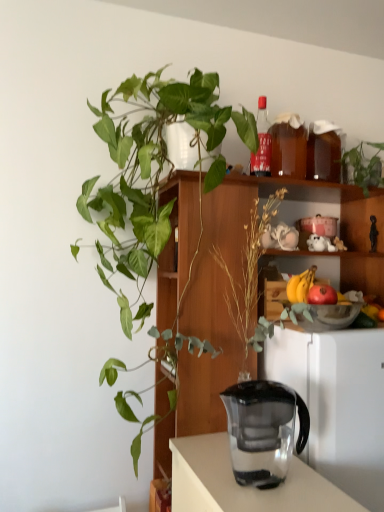
Locate an element on the screen. Image resolution: width=384 pixels, height=512 pixels. vacant region above translucent glass bowl at upper right (from a real-world perspective) is located at coordinates (329, 300).